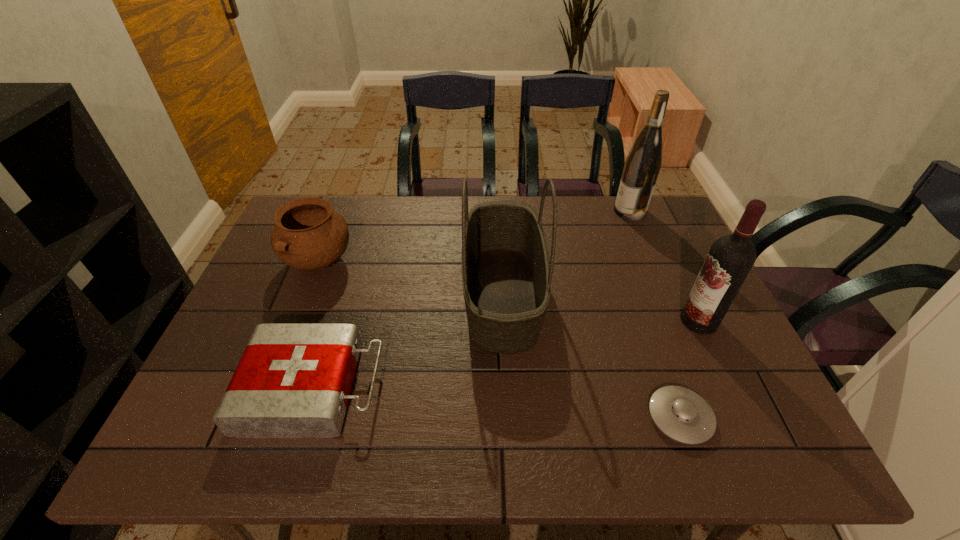
Locate an element on the screen. vacant space located on the front of the basket is located at coordinates (511, 450).

Where is `free spot located on the right of the third shortest object`? This screenshot has width=960, height=540. free spot located on the right of the third shortest object is located at coordinates (389, 261).

You are a GUI agent. You are given a task and a screenshot of the screen. Output one action in this format:
    pyautogui.click(x=<x>, y=<y>)
    Task: Click on the vacant space located on the front side of the first-aid kit
    The width and height of the screenshot is (960, 540).
    Given the screenshot: What is the action you would take?
    pyautogui.click(x=447, y=388)

The width and height of the screenshot is (960, 540). What are the coordinates of `vacant space positioned on the back of the saucer` in the screenshot? It's located at (631, 278).

This screenshot has width=960, height=540. I want to click on wine bottle that is at the far edge, so click(x=643, y=163).

What are the coordinates of `basket that is at the far edge` in the screenshot? It's located at (506, 277).

Find the location of a particular element. pottery situated at the far edge is located at coordinates (308, 235).

Where is `the first-aid kit present at the near edge`? The width and height of the screenshot is (960, 540). the first-aid kit present at the near edge is located at coordinates (293, 380).

Locate an element on the screen. The width and height of the screenshot is (960, 540). saucer positioned at the near edge is located at coordinates (681, 414).

You are a GUI agent. You are given a task and a screenshot of the screen. Output one action in this format:
    pyautogui.click(x=<x>, y=<y>)
    Task: Click on the pottery present at the left edge
    The height and width of the screenshot is (540, 960).
    Given the screenshot: What is the action you would take?
    pyautogui.click(x=308, y=235)